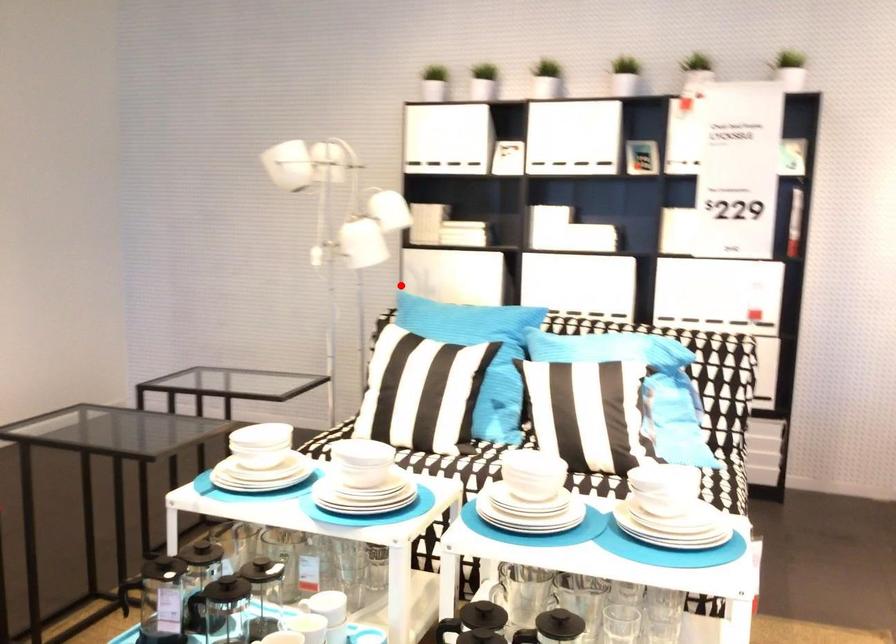
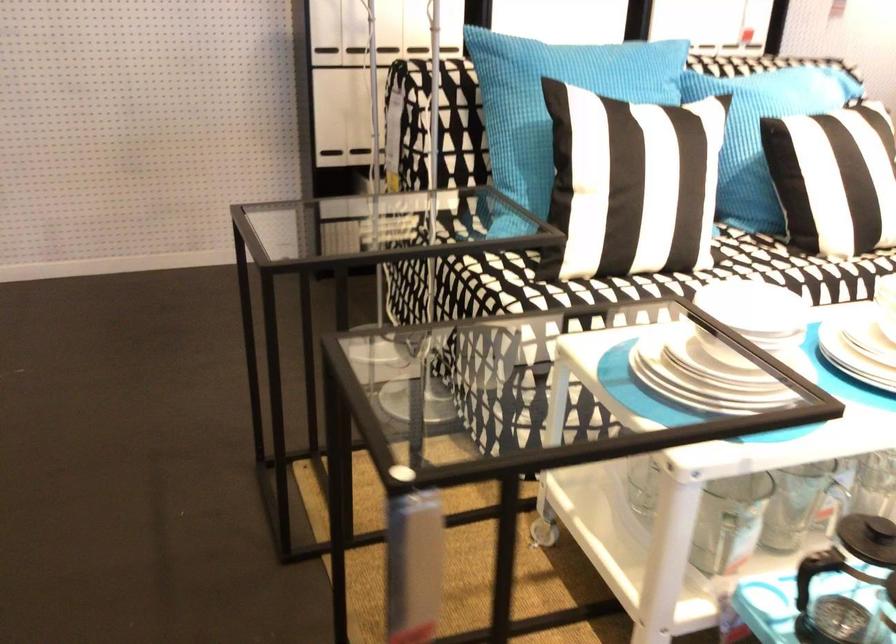
Question: I am providing you with two images of the same scene from different viewpoints. Image1 has a red point marked. In image2, the corresponding 3D location appears at what relative position? Reply with the corresponding letter.

Choices:
 (A) Closer
 (B) Farther

Answer: (A)